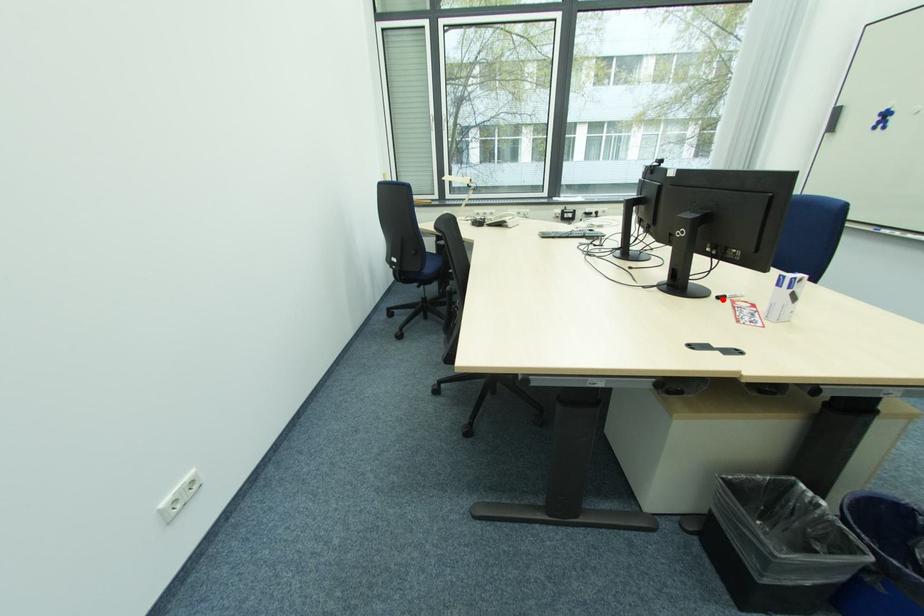
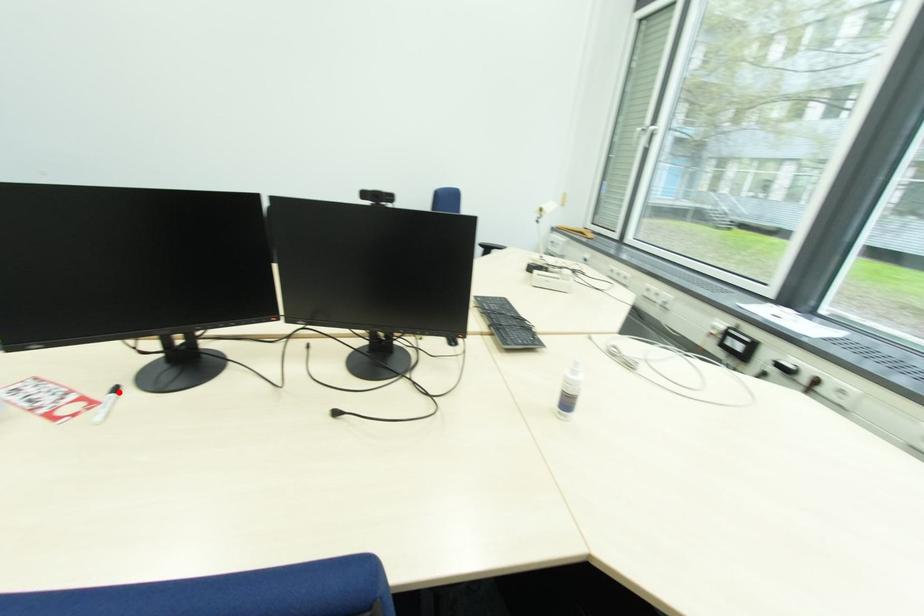
Based on the photo, I am providing you with two images of the same scene from different viewpoints. A red point is marked on the first image and another point is marked on the second image. Are the points marked in image1 and image2 representing the same 3D position?

Yes